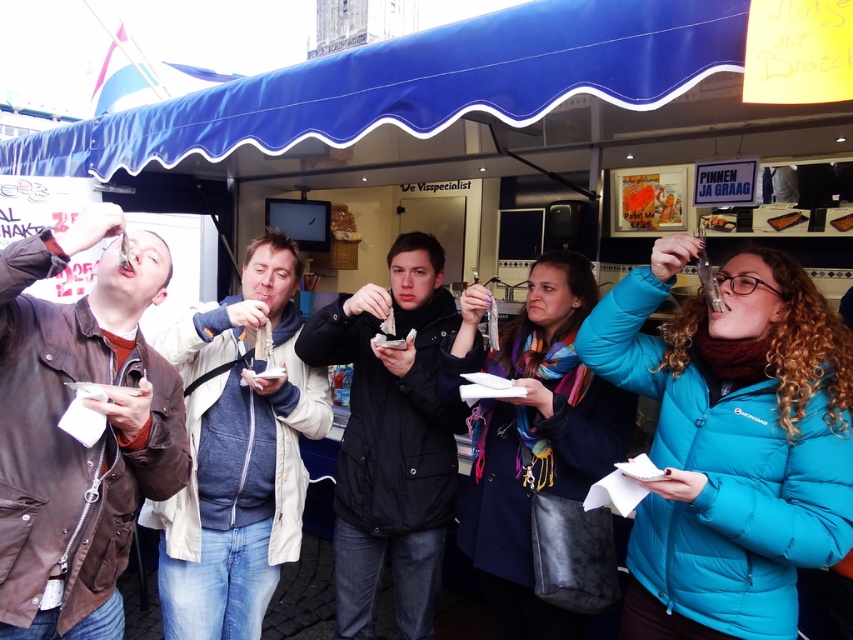
Between brown wooden stick at upper center and matte plastic spoon at upper center, which one is positioned lower?

brown wooden stick at upper center

Is the position of brown wooden stick at upper center less distant than that of matte plastic spoon at upper center?

Yes, brown wooden stick at upper center is closer to the viewer.

Locate an element on the screen. brown wooden stick at upper center is located at coordinates (786, 220).

Which is above, blue quilted jacket at center or brown wooden plate at center?

brown wooden plate at center

Find the location of a particular element. blue quilted jacket at center is located at coordinates (531, 436).

Can you confirm if blue fabric canopy at upper center is positioned above brown wooden plate at center?

Yes.

Between point (641, 106) and point (846, 216), which one is positioned in front?

Point (641, 106)

Does point (648, 17) come in front of point (836, 225)?

Yes, it is.

I want to click on blue fabric canopy at upper center, so click(x=428, y=83).